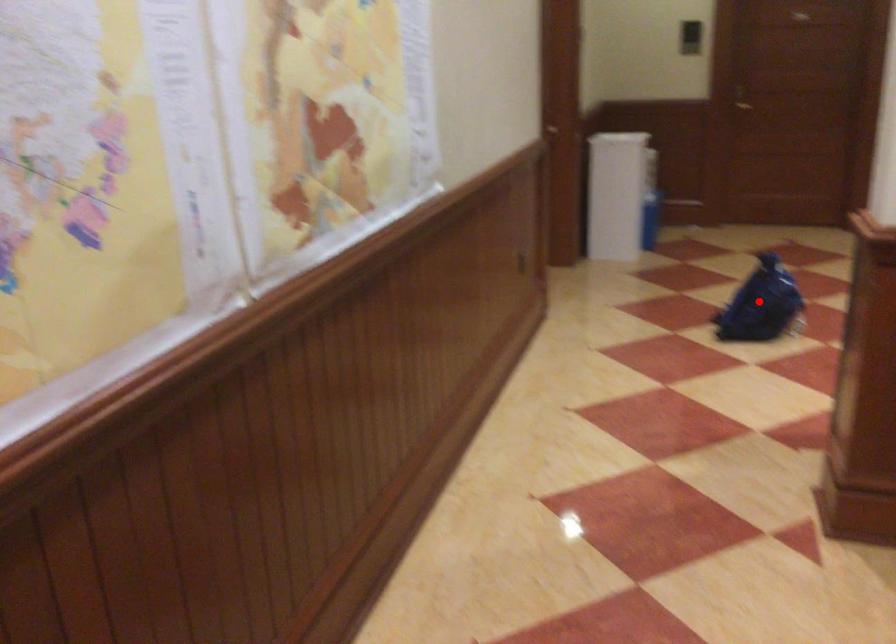
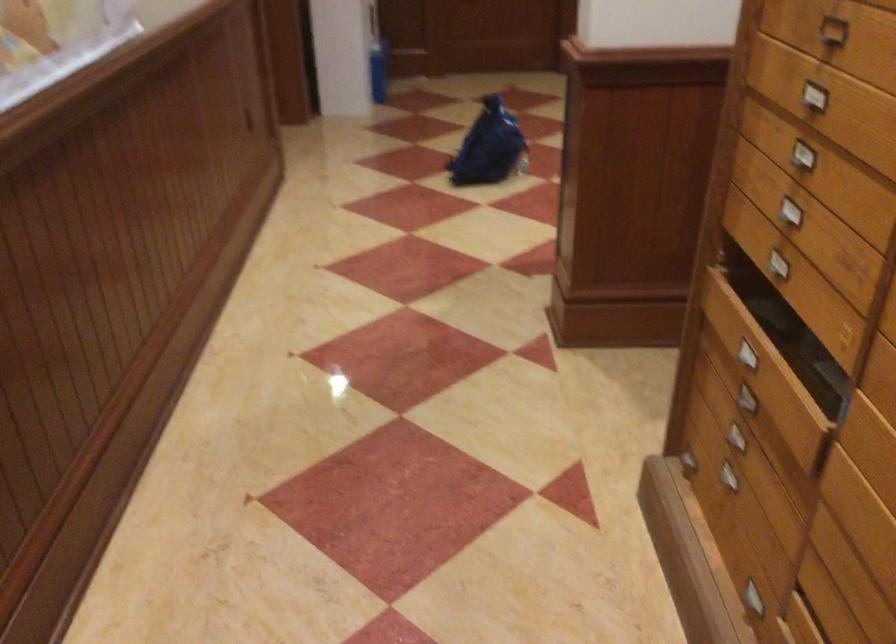
The point at the highlighted location is marked in the first image. Where is the corresponding point in the second image?

(488, 147)